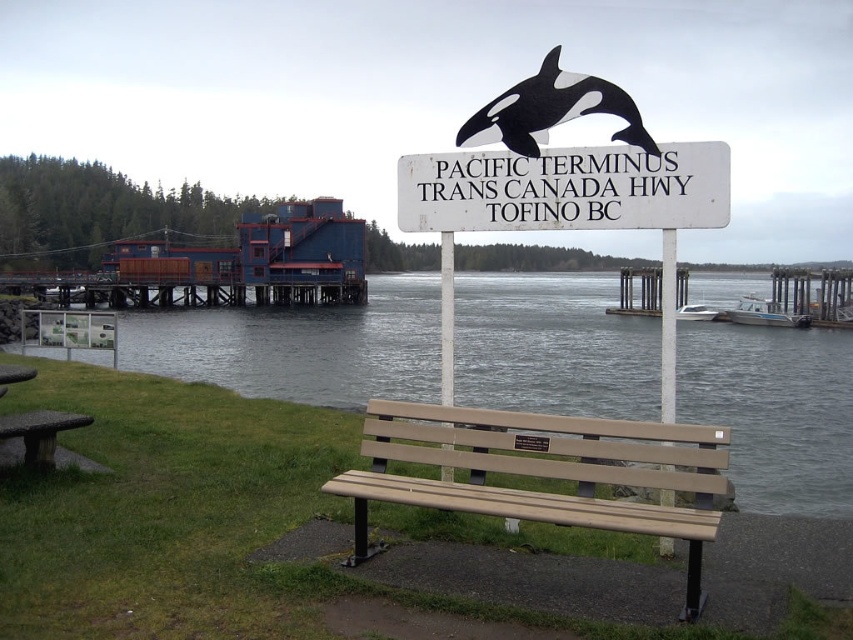
Question: Is white wooden sign at center smaller than stone textured picnic table at lower left?

Choices:
 (A) no
 (B) yes

Answer: (A)

Question: Is tan plastic bench at center wider than white wooden sign at center?

Choices:
 (A) yes
 (B) no

Answer: (A)

Question: Which of the following is the closest to the observer?

Choices:
 (A) clear water at bench right
 (B) black matte orca at upper center

Answer: (B)

Question: Considering the real-world distances, which object is farthest from the white wooden sign at center?

Choices:
 (A) tan plastic bench at center
 (B) stone textured picnic table at lower left

Answer: (B)

Question: Among these objects, which one is nearest to the camera?

Choices:
 (A) tan plastic bench at center
 (B) stone textured picnic table at lower left
 (C) white wooden sign at center
 (D) black matte orca at upper center

Answer: (A)

Question: Can you confirm if black matte orca at upper center is thinner than stone textured picnic table at lower left?

Choices:
 (A) yes
 (B) no

Answer: (B)